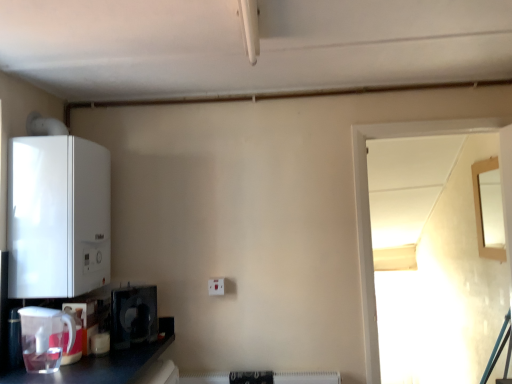
Question: Can you confirm if wooden framed mirror at upper right, the 1th window when ordered from right to left, is shorter than black plastic microwave at lower left, the second appliance in the bottom-to-top sequence?

Choices:
 (A) yes
 (B) no

Answer: (B)

Question: Considering the relative positions of wooden framed mirror at upper right, the 1th window when ordered from right to left, and black plastic microwave at lower left, which ranks as the 3th appliance in top-to-bottom order, in the image provided, is wooden framed mirror at upper right, the 1th window when ordered from right to left, to the left of black plastic microwave at lower left, which ranks as the 3th appliance in top-to-bottom order, from the viewer's perspective?

Choices:
 (A) no
 (B) yes

Answer: (A)

Question: Is wooden framed mirror at upper right, the 1th window when ordered from right to left, closer to the viewer compared to black plastic microwave at lower left, the second appliance in the bottom-to-top sequence?

Choices:
 (A) yes
 (B) no

Answer: (B)

Question: Does wooden framed mirror at upper right, acting as the second window starting from the front, have a greater width compared to black plastic microwave at lower left, which ranks as the 3th appliance in top-to-bottom order?

Choices:
 (A) yes
 (B) no

Answer: (B)

Question: Is wooden framed mirror at upper right, the 1th window when ordered from right to left, smaller than black plastic microwave at lower left, the second appliance in the bottom-to-top sequence?

Choices:
 (A) no
 (B) yes

Answer: (A)

Question: Could you tell me if wooden framed mirror at upper right, the 2th window from the left, is turned towards black plastic microwave at lower left, the second appliance in the bottom-to-top sequence?

Choices:
 (A) yes
 (B) no

Answer: (A)

Question: Does black plastic microwave at lower left, which ranks as the 3th appliance in top-to-bottom order, have a lesser width compared to matte white kettle at lower left, which is the first appliance from bottom to top?

Choices:
 (A) yes
 (B) no

Answer: (A)

Question: Is black plastic microwave at lower left, the second appliance in the bottom-to-top sequence, to the left of matte white kettle at lower left, which is the first appliance from bottom to top, from the viewer's perspective?

Choices:
 (A) no
 (B) yes

Answer: (A)

Question: Can you confirm if black plastic microwave at lower left, which ranks as the 3th appliance in top-to-bottom order, is shorter than matte white kettle at lower left, which is the first appliance from bottom to top?

Choices:
 (A) no
 (B) yes

Answer: (A)

Question: Is black plastic microwave at lower left, the second appliance in the bottom-to-top sequence, not near matte white kettle at lower left, the fourth appliance from the top?

Choices:
 (A) yes
 (B) no

Answer: (B)

Question: Is black plastic microwave at lower left, which ranks as the 3th appliance in top-to-bottom order, outside matte white kettle at lower left, the fourth appliance from the top?

Choices:
 (A) no
 (B) yes

Answer: (B)

Question: Can you confirm if black plastic microwave at lower left, the second appliance in the bottom-to-top sequence, is taller than matte white kettle at lower left, which is the first appliance from bottom to top?

Choices:
 (A) no
 (B) yes

Answer: (B)

Question: Is white plastic electric outlet at center thinner than transparent glass door at right, acting as the second window starting from the right?

Choices:
 (A) no
 (B) yes

Answer: (B)